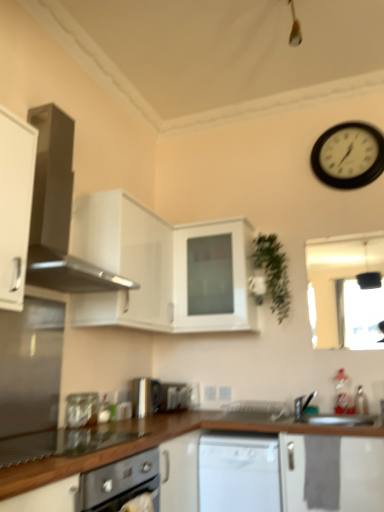
Question: In terms of size, does black plastic wall clock at upper right appear bigger or smaller than white glossy dishwasher at center?

Choices:
 (A) small
 (B) big

Answer: (A)

Question: Looking at their shapes, would you say black plastic wall clock at upper right is wider or thinner than white glossy dishwasher at center?

Choices:
 (A) wide
 (B) thin

Answer: (B)

Question: Which object is the closest to the black plastic wall clock at upper right?

Choices:
 (A) clear glass jar at lower left, which is counted as the third appliance, starting from the back
 (B) white matte cabinet at left, the 1th cabinetry in the front-to-back sequence
 (C) white matte cabinet at center, positioned as the first cabinetry in back-to-front order
 (D) brown wood countertop at lower center
 (E) green matte plant at upper right

Answer: (E)

Question: Estimate the real-world distances between objects in this image. Which object is closer to the white glossy dishwasher at center?

Choices:
 (A) white glossy cabinet at upper center, positioned as the 2th cabinetry in front-to-back order
 (B) satin silver toaster at center, which appears as the 1th appliance when viewed from the right
 (C) satin silver toaster at lower center, positioned as the 2th appliance in right-to-left order
 (D) clear glass jar at lower left, placed as the first appliance when sorted from front to back
 (E) white matte cabinet at left, the 1th cabinetry in the front-to-back sequence

Answer: (C)